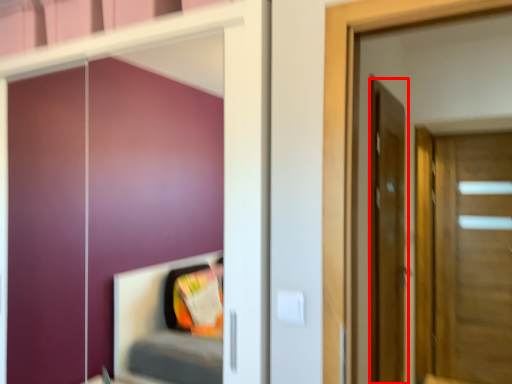
Question: From the image's perspective, where is door (annotated by the red box) located in relation to door in the image?

Choices:
 (A) below
 (B) above

Answer: (B)